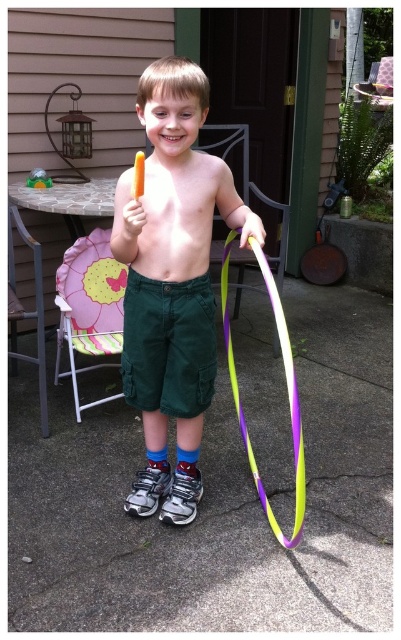
You are a photographer taking a picture of the boy in the backyard. You notice the shiny skin at center and dark green cotton shorts at center. Which object is closer to the camera?

The dark green cotton shorts at center is closer to the camera because the shiny skin at center is behind it.

The boy in the image is holding a popsicle and a hula hoop. Considering the boy is wearing matte green shorts at center and has shiny skin at center, which of these two items is taller?

The matte green shorts at center is much taller than the shiny skin at center.